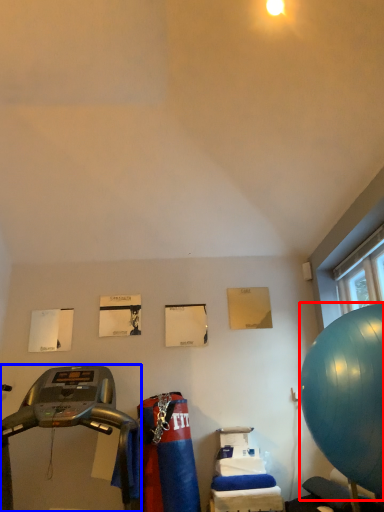
Question: Which point is closer to the camera, ball (highlighted by a red box) or treadmill (highlighted by a blue box)?

Choices:
 (A) ball
 (B) treadmill

Answer: (B)